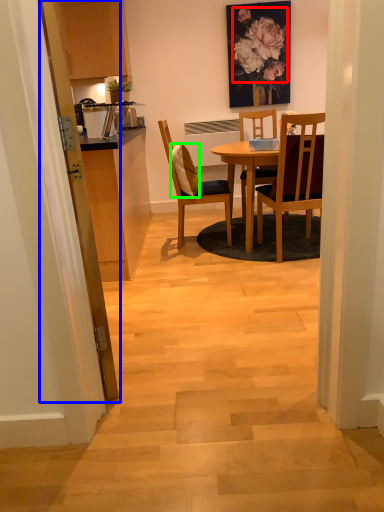
Question: Estimate the real-world distances between objects in this image. Which object is farther from flower (highlighted by a red box), glass door (highlighted by a blue box) or pillow (highlighted by a green box)?

Choices:
 (A) glass door
 (B) pillow

Answer: (A)